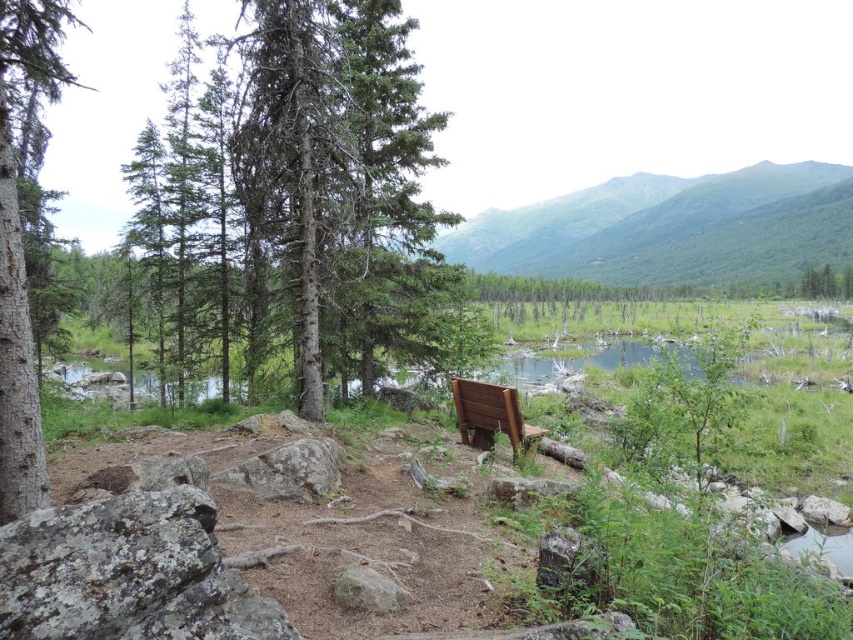
Question: Does green forested mountain at upper center have a lesser width compared to wooden bench at center?

Choices:
 (A) no
 (B) yes

Answer: (A)

Question: Is green textured tree at center positioned at the back of wooden bench at center?

Choices:
 (A) yes
 (B) no

Answer: (A)

Question: Is green forested mountain at upper center thinner than wooden bench at center?

Choices:
 (A) no
 (B) yes

Answer: (A)

Question: Which point appears closest to the camera in this image?

Choices:
 (A) (364, 230)
 (B) (531, 244)
 (C) (22, 372)

Answer: (C)

Question: Based on their relative distances, which object is farther from the green textured tree at center?

Choices:
 (A) green forested mountain at upper center
 (B) green matte tree at left
 (C) wooden bench at center

Answer: (A)

Question: Which point is farther from the camera taking this photo?

Choices:
 (A) (267, 332)
 (B) (467, 442)
 (C) (24, 369)

Answer: (A)